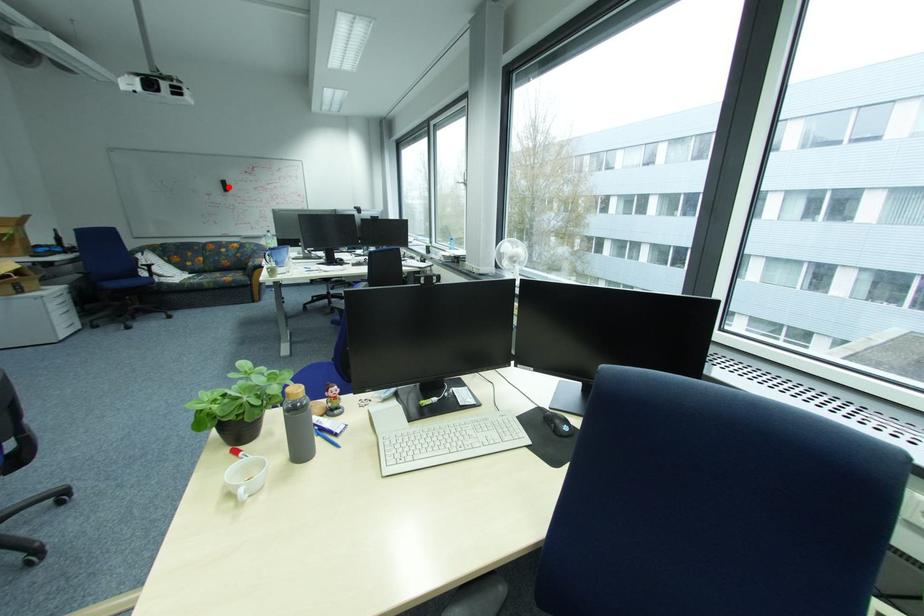
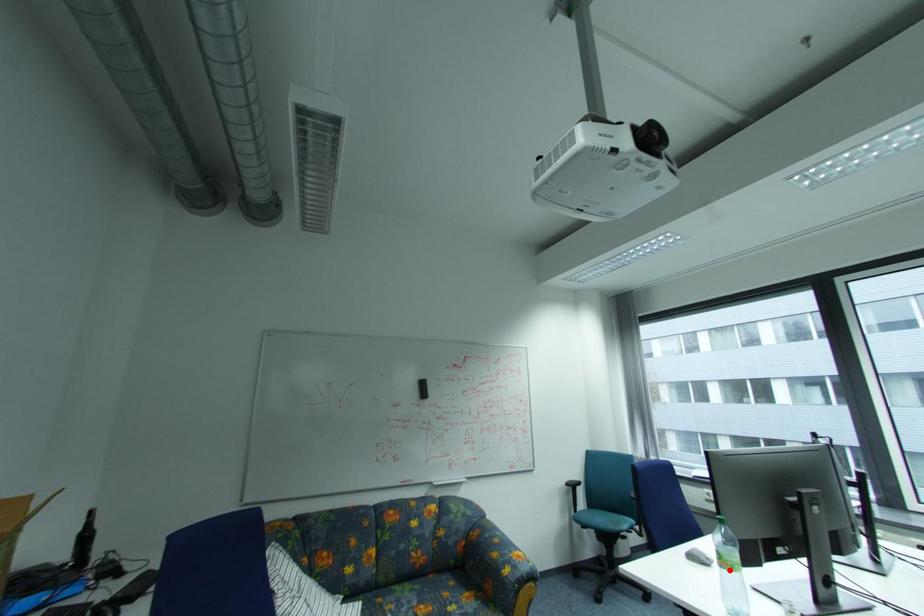
I am providing you with two images of the same scene from different viewpoints. A red point is marked on the first image and another point is marked on the second image. Is the marked point in image1 the same physical position as the marked point in image2?

No